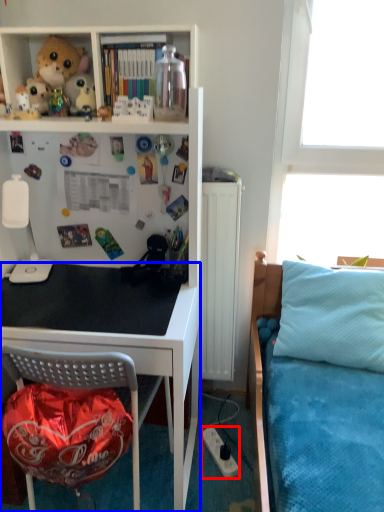
Question: Which object appears closest to the camera in this image, power outlet (highlighted by a red box) or desk (highlighted by a blue box)?

Choices:
 (A) power outlet
 (B) desk

Answer: (B)